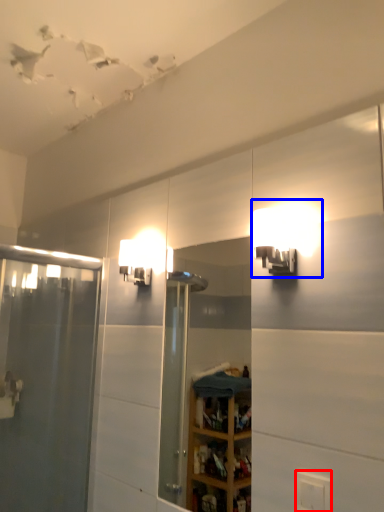
Question: Among these objects, which one is nearest to the camera, electric outlet (highlighted by a red box) or light fixture (highlighted by a blue box)?

Choices:
 (A) electric outlet
 (B) light fixture

Answer: (A)